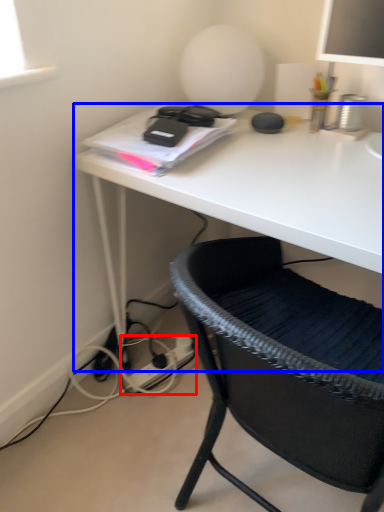
Question: Among these objects, which one is nearest to the camera, plug (highlighted by a red box) or desk (highlighted by a blue box)?

Choices:
 (A) plug
 (B) desk

Answer: (B)